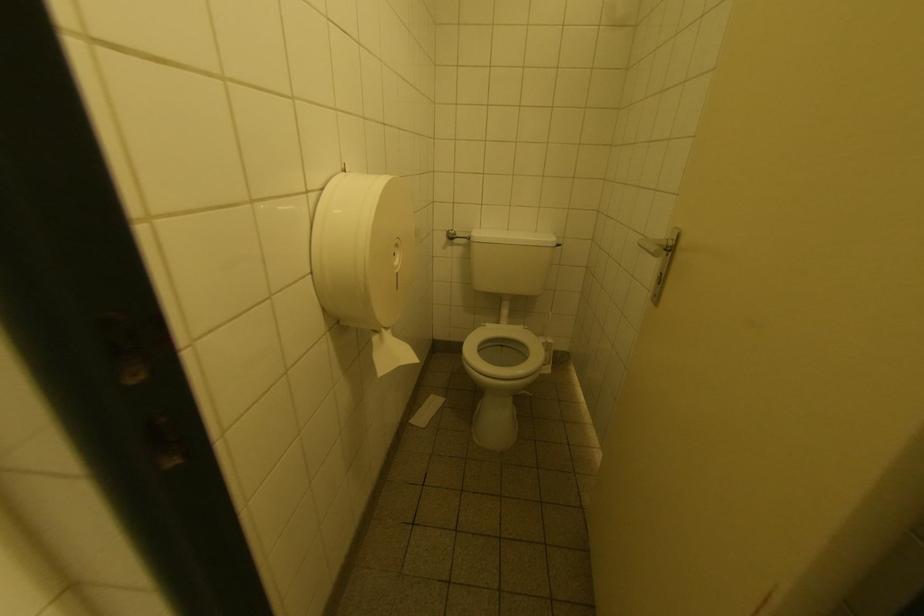
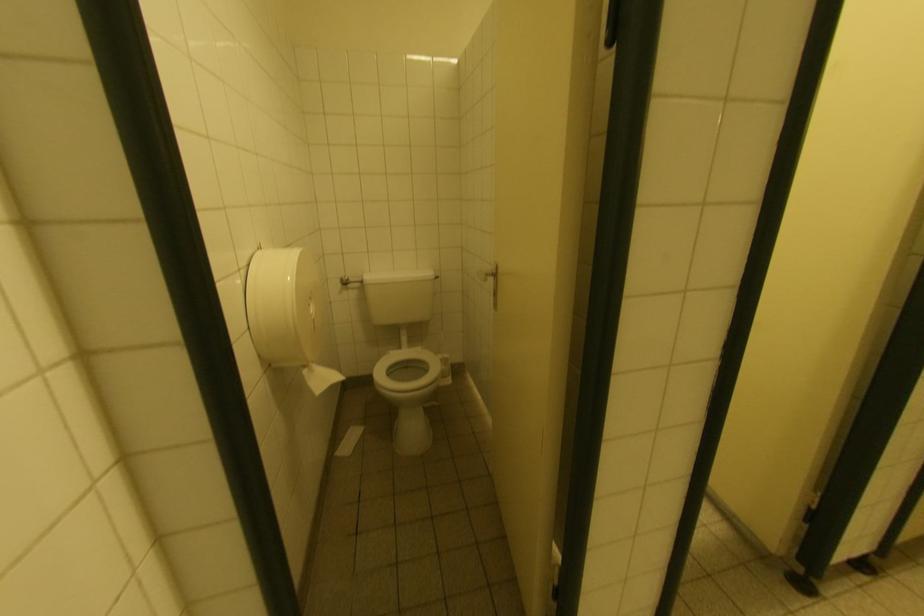
Question: Based on the continuous images, in which direction is the camera rotating? Reply with the corresponding letter.

Choices:
 (A) Left
 (B) Right
 (C) Up
 (D) Down

Answer: (B)